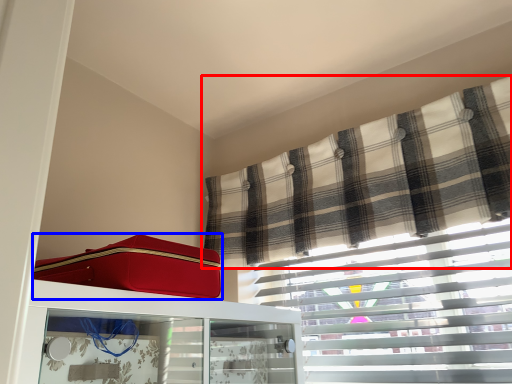
Question: Which object appears farthest to the camera in this image, curtain (highlighted by a red box) or suitcase (highlighted by a blue box)?

Choices:
 (A) curtain
 (B) suitcase

Answer: (A)